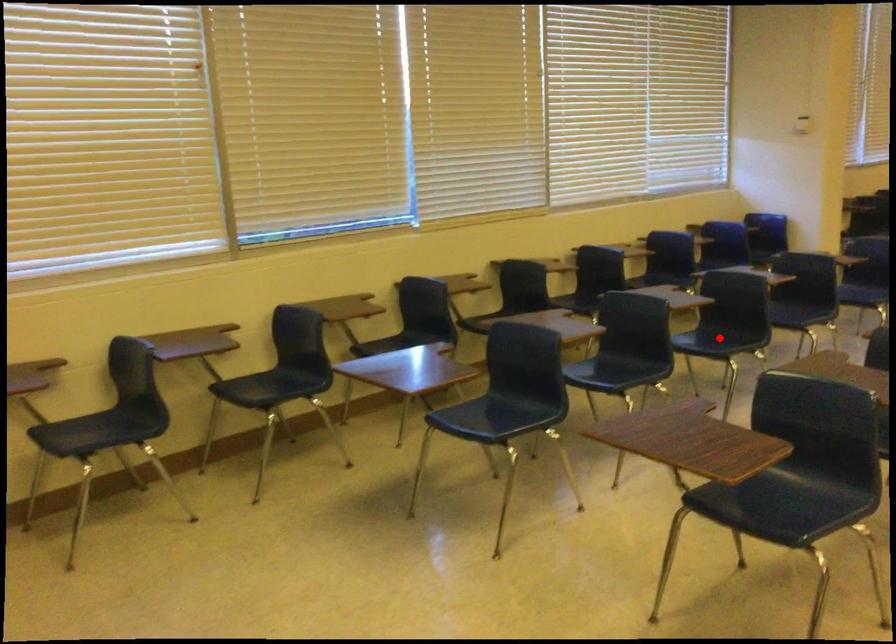
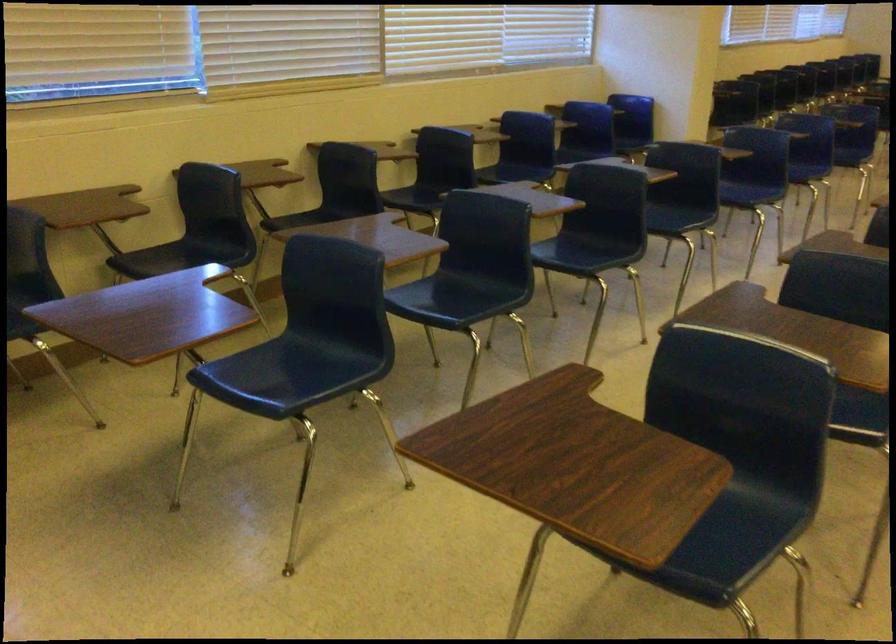
Question: I am providing you with two images of the same scene from different viewpoints. A red point is shown in image1. For the corresponding object point in image2, is it positioned nearer or farther from the camera?

Choices:
 (A) Nearer
 (B) Farther

Answer: (A)